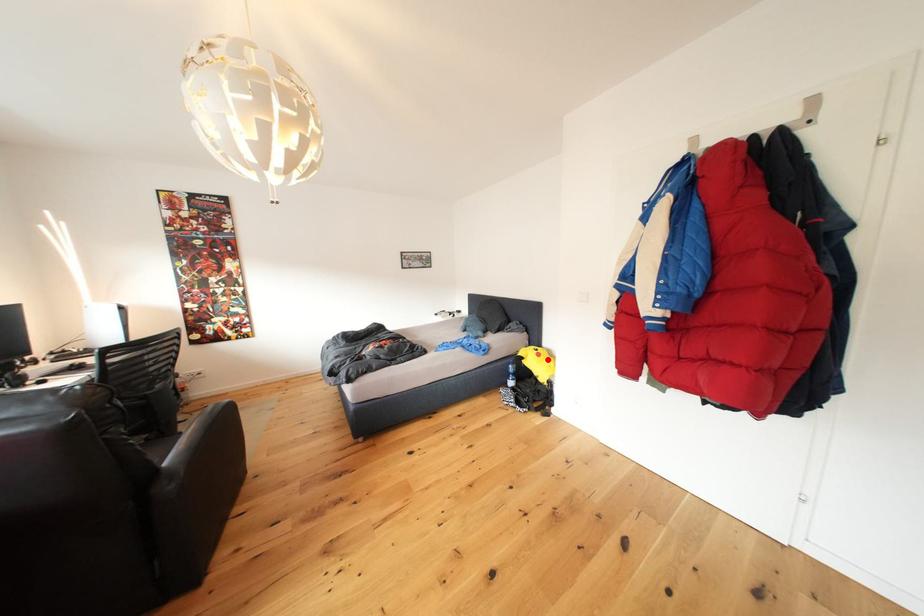
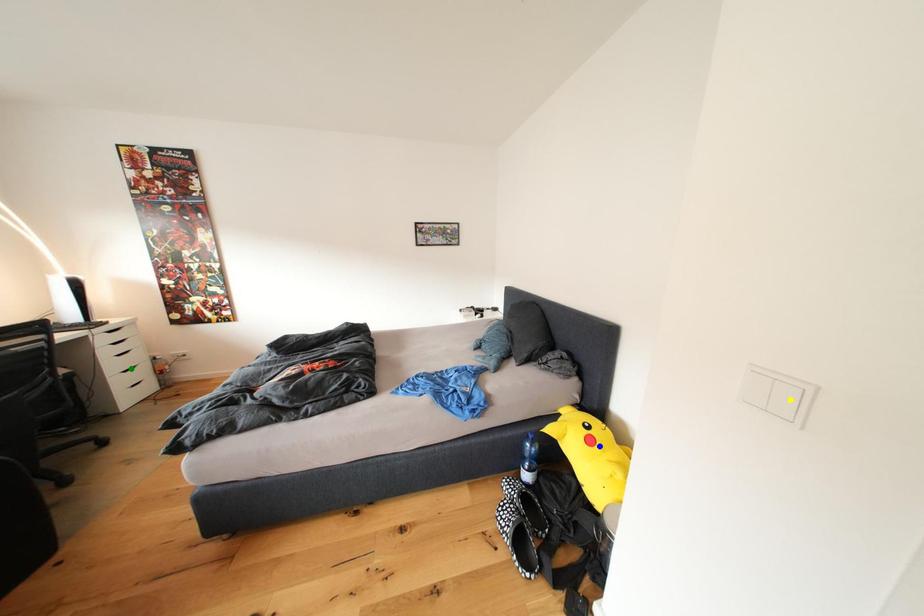
Question: I am providing you with two images of the same scene from different viewpoints. A red point is marked on the first image. You are given multiple points on the second image. Can you choose the point in image 2 that corresponds to the point in image 1?

Choices:
 (A) green point
 (B) yellow point
 (C) blue point

Answer: (C)